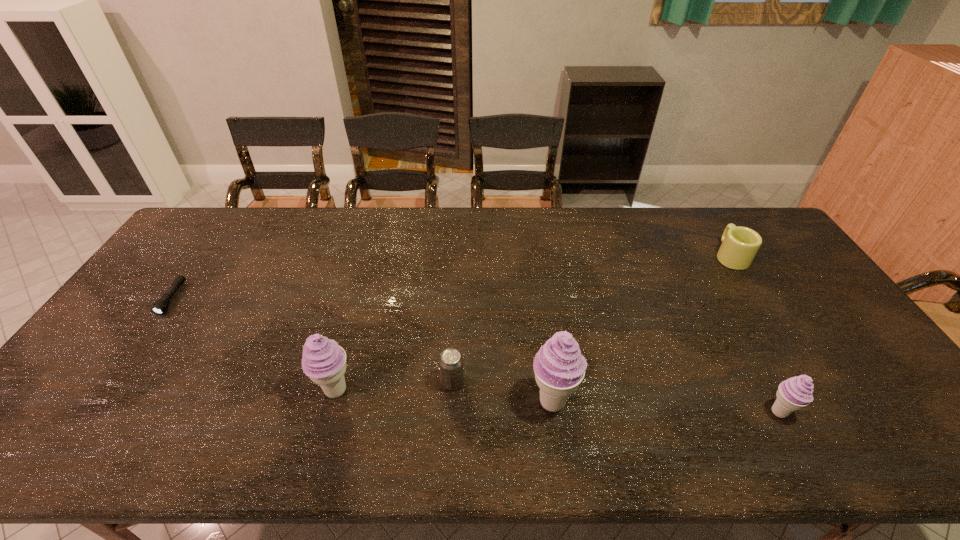
With all icecreams evenly spaced, where should an extra icecream be placed on the left to continue the pattern? Please point out a vacant space. Please provide its 2D coordinates. Your answer should be formatted as a tuple, i.e. [(x, y)], where the tuple contains the x and y coordinates of a point satisfying the conditions above.

[(127, 381)]